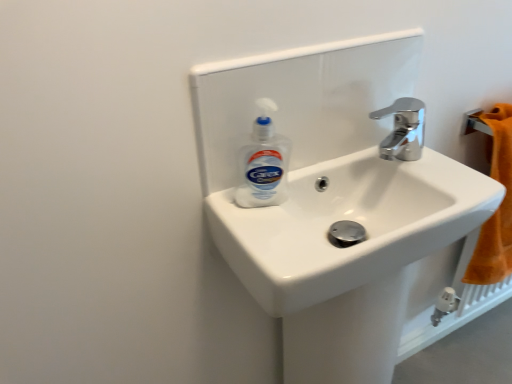
Question: Is chrome metallic faucet at upper right to the right of white glossy sink at center from the viewer's perspective?

Choices:
 (A) no
 (B) yes

Answer: (B)

Question: Is chrome metallic faucet at upper right wider than white glossy sink at center?

Choices:
 (A) yes
 (B) no

Answer: (B)

Question: From the image's perspective, would you say chrome metallic faucet at upper right is positioned over white glossy sink at center?

Choices:
 (A) yes
 (B) no

Answer: (A)

Question: Is chrome metallic faucet at upper right facing towards white glossy sink at center?

Choices:
 (A) no
 (B) yes

Answer: (A)

Question: Is chrome metallic faucet at upper right thinner than white glossy sink at center?

Choices:
 (A) no
 (B) yes

Answer: (B)

Question: From the image's perspective, relative to white plastic bottle at center, is white glossy sink at center above or below?

Choices:
 (A) below
 (B) above

Answer: (A)

Question: Relative to white plastic bottle at center, is white glossy sink at center in front or behind?

Choices:
 (A) front
 (B) behind

Answer: (A)

Question: Does point (352, 216) appear closer or farther from the camera than point (245, 162)?

Choices:
 (A) closer
 (B) farther

Answer: (B)

Question: Is white glossy sink at center spatially inside white plastic bottle at center, or outside of it?

Choices:
 (A) outside
 (B) inside

Answer: (A)

Question: From a real-world perspective, is white plastic bottle at center physically located above or below white glossy sink at center?

Choices:
 (A) below
 (B) above

Answer: (B)

Question: Is white plastic bottle at center bigger or smaller than white glossy sink at center?

Choices:
 (A) small
 (B) big

Answer: (A)

Question: In terms of width, does white plastic bottle at center look wider or thinner when compared to white glossy sink at center?

Choices:
 (A) wide
 (B) thin

Answer: (B)

Question: Is white plastic bottle at center situated inside white glossy sink at center or outside?

Choices:
 (A) outside
 (B) inside

Answer: (A)

Question: From the image's perspective, is chrome metallic faucet at upper right positioned above or below white glossy sink at center?

Choices:
 (A) below
 (B) above

Answer: (B)

Question: Considering the positions of point click(x=406, y=110) and point click(x=328, y=243), is point click(x=406, y=110) closer or farther from the camera than point click(x=328, y=243)?

Choices:
 (A) farther
 (B) closer

Answer: (A)